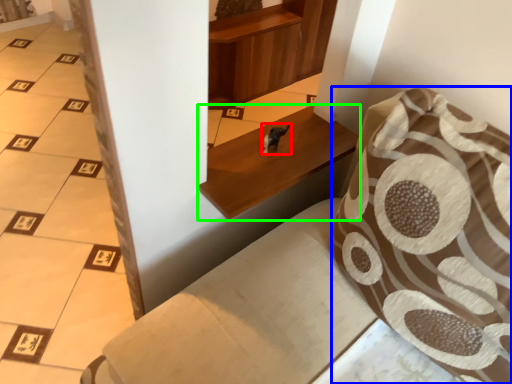
Question: Considering the real-world distances, which object is closest to animal (highlighted by a red box)? throw pillow (highlighted by a blue box) or furniture (highlighted by a green box).

Choices:
 (A) throw pillow
 (B) furniture

Answer: (B)